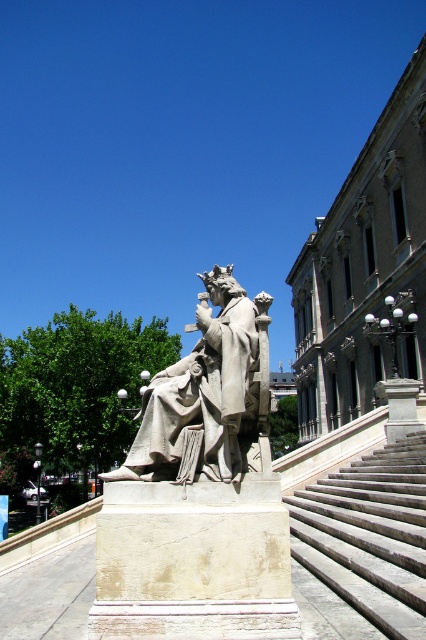
You are standing in the plaza and want to take a photo of the stone statue at center. The camera app shows a grid with a point at coordinate [198,493]. Where should you aim your camera to capture the statue?

The point at coordinate [198,493] marks the location of the stone statue at center, so aim your camera at that point to capture the statue.

Consider the image. You are a tourist standing at the base of the stone stairs at center, wanting to take a photo of the stone statue at center. Since you have a wide angle lens, you can capture both objects in one shot. However, you want the statue to appear larger in the photo than the stairs. Should you move closer to or farther away from the stairs?

You should move closer to the stairs. Since the stone statue at center is smaller than the stone stairs at center in reality, moving closer will make the statue appear larger relative to the stairs in the photo.